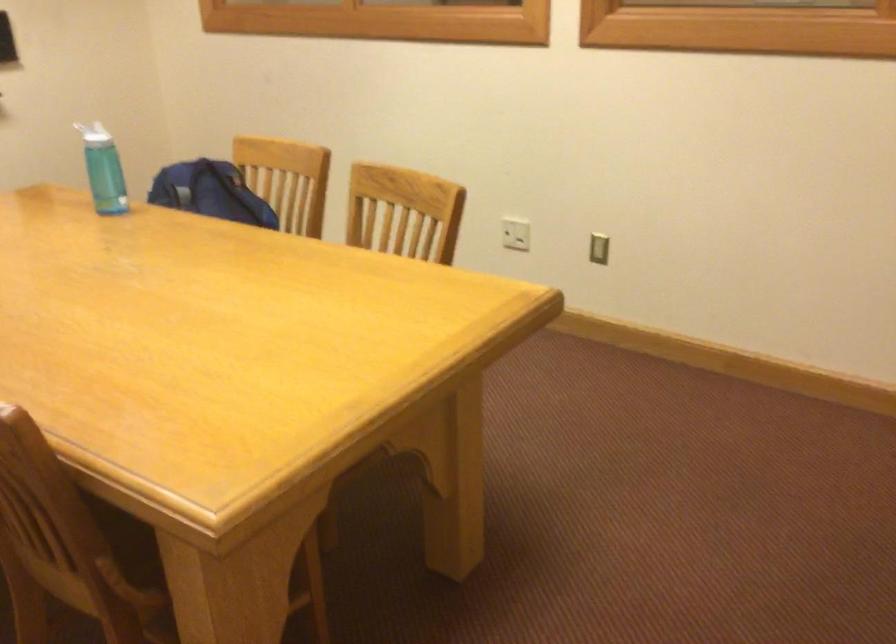
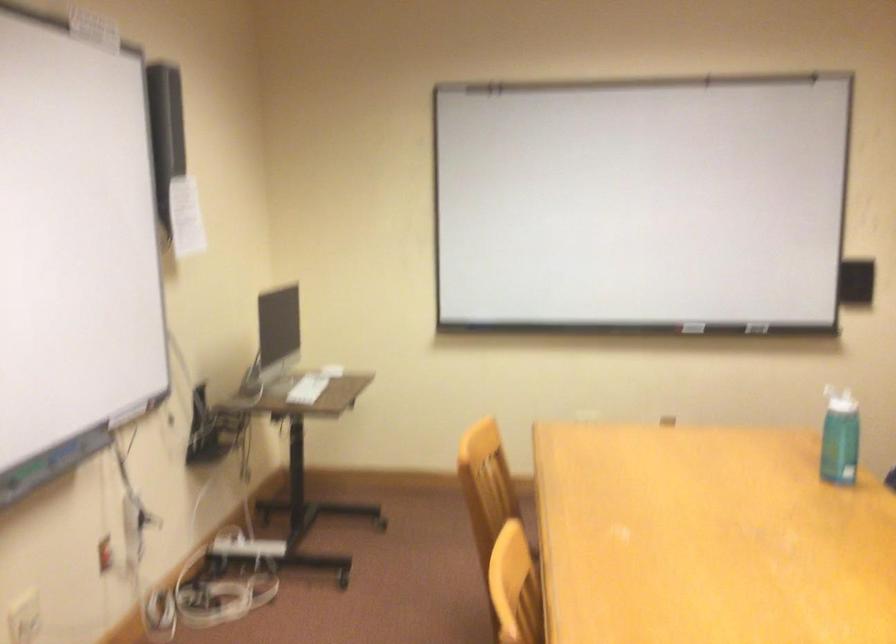
Question: The first image is from the beginning of the video and the second image is from the end. How did the camera likely rotate when shooting the video?

Choices:
 (A) Left
 (B) Right
 (C) Up
 (D) Down

Answer: (A)